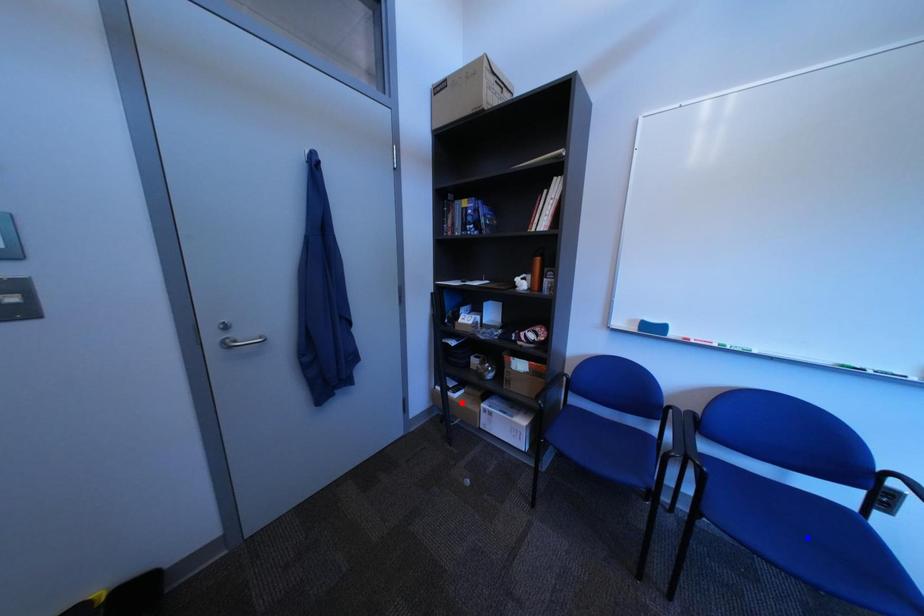
Question: Two points are marked on the image. Which point is closer to the camera?

Choices:
 (A) Blue point is closer.
 (B) Red point is closer.

Answer: (A)